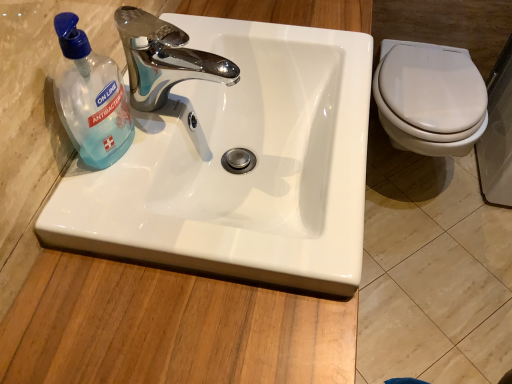
Image resolution: width=512 pixels, height=384 pixels. I want to click on free space in front of chrome/metallic faucet at upper center, so click(148, 196).